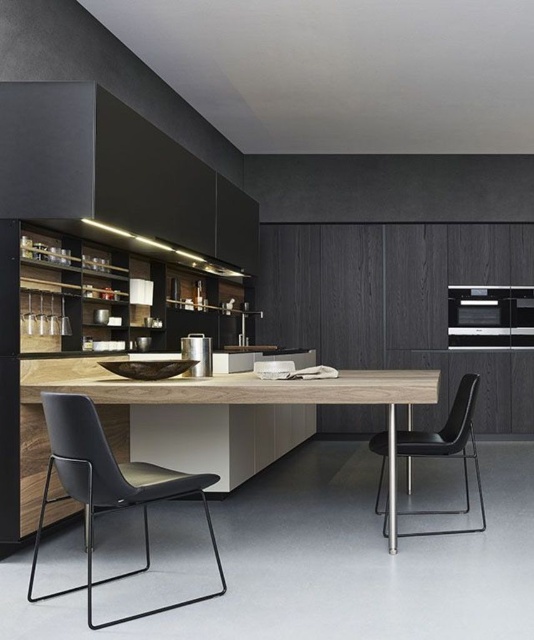
Question: Which object is positioned closest to the wooden table at center?

Choices:
 (A) black leather chair at center
 (B) matte black exhaust hood at upper left
 (C) light wood countertop at center
 (D) metallic silver canister at center

Answer: (C)

Question: Which object is farther from the camera taking this photo?

Choices:
 (A) satin silver oven at center
 (B) black leather chair at center
 (C) matte black exhaust hood at upper left

Answer: (A)

Question: Does matte black exhaust hood at upper left have a greater width compared to wooden table at center?

Choices:
 (A) no
 (B) yes

Answer: (A)

Question: Which point is farther to the camera?

Choices:
 (A) black leather chair at center
 (B) satin silver oven at center

Answer: (B)

Question: Observing the image, what is the correct spatial positioning of matte black exhaust hood at upper left in reference to black leather chair at lower left?

Choices:
 (A) above
 (B) below

Answer: (A)

Question: Can you confirm if satin silver oven at center is positioned to the right of metallic silver canister at center?

Choices:
 (A) yes
 (B) no

Answer: (A)